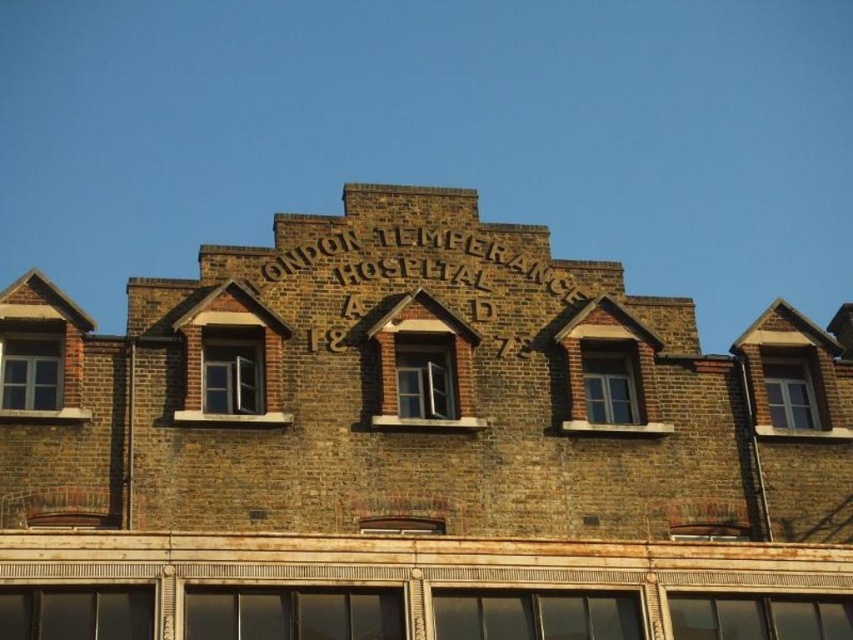
Is matte glass window at center to the left of matte gray window at upper right from the viewer's perspective?

Correct, you'll find matte glass window at center to the left of matte gray window at upper right.

Can you confirm if matte glass window at center is positioned below matte gray window at upper right?

Indeed, matte glass window at center is positioned under matte gray window at upper right.

What do you see at coordinates (293, 612) in the screenshot?
I see `matte glass window at center` at bounding box center [293, 612].

Find the location of a particular element. This screenshot has width=853, height=640. matte glass window at center is located at coordinates tap(293, 612).

Who is lower down, dark glass window at center or matte brick window at center-left?

Positioned lower is dark glass window at center.

Is dark glass window at center bigger than matte brick window at center-left?

No, dark glass window at center is not bigger than matte brick window at center-left.

Where is `dark glass window at center`? dark glass window at center is located at coordinates (535, 616).

Where is `dark glass window at center`? The image size is (853, 640). dark glass window at center is located at coordinates (535, 616).

Where is `matte brown window at left`? This screenshot has width=853, height=640. matte brown window at left is located at coordinates (30, 371).